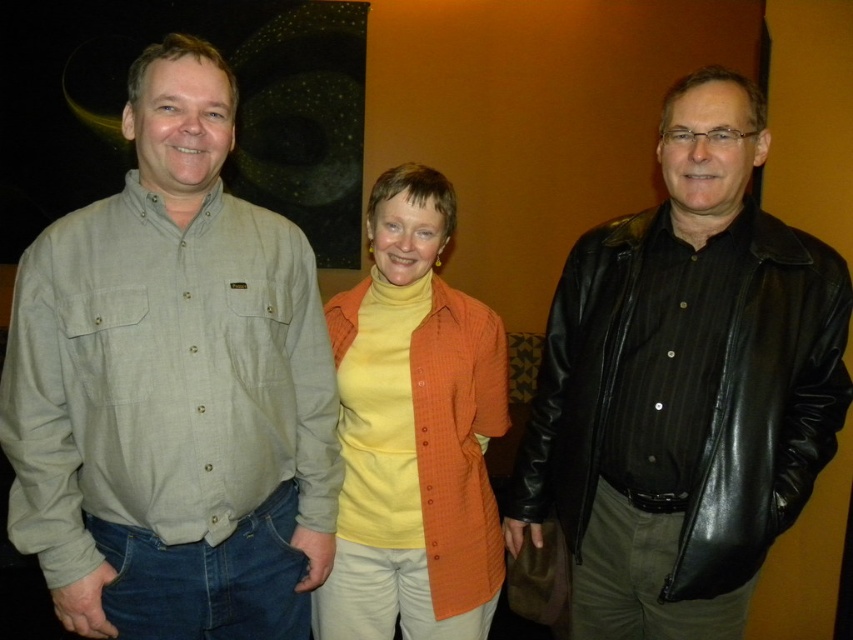
From the picture: Measure the distance from light gray button-down shirt at left to orange textured cardigan at center.

light gray button-down shirt at left is 30.80 centimeters from orange textured cardigan at center.

Between point (111, 614) and point (401, 424), which one is positioned in front?

Point (111, 614) is more forward.

Locate an element on the screen. The image size is (853, 640). light gray button-down shirt at left is located at coordinates (172, 388).

The height and width of the screenshot is (640, 853). Describe the element at coordinates (172, 388) in the screenshot. I see `light gray button-down shirt at left` at that location.

Consider the image. Does light gray button-down shirt at left come behind black leather jacket at right?

No, it is not.

Does point (279, 442) come farther from viewer compared to point (646, 339)?

No, (279, 442) is closer to viewer.

Image resolution: width=853 pixels, height=640 pixels. In order to click on light gray button-down shirt at left in this screenshot , I will do `click(172, 388)`.

In the scene shown: Which is more to the right, black leather jacket at right or orange textured cardigan at center?

From the viewer's perspective, black leather jacket at right appears more on the right side.

Which is more to the left, black leather jacket at right or orange textured cardigan at center?

orange textured cardigan at center is more to the left.

Is point (764, 465) farther from camera compared to point (344, 410)?

No.

Where is `black leather jacket at right`? The height and width of the screenshot is (640, 853). black leather jacket at right is located at coordinates (683, 385).